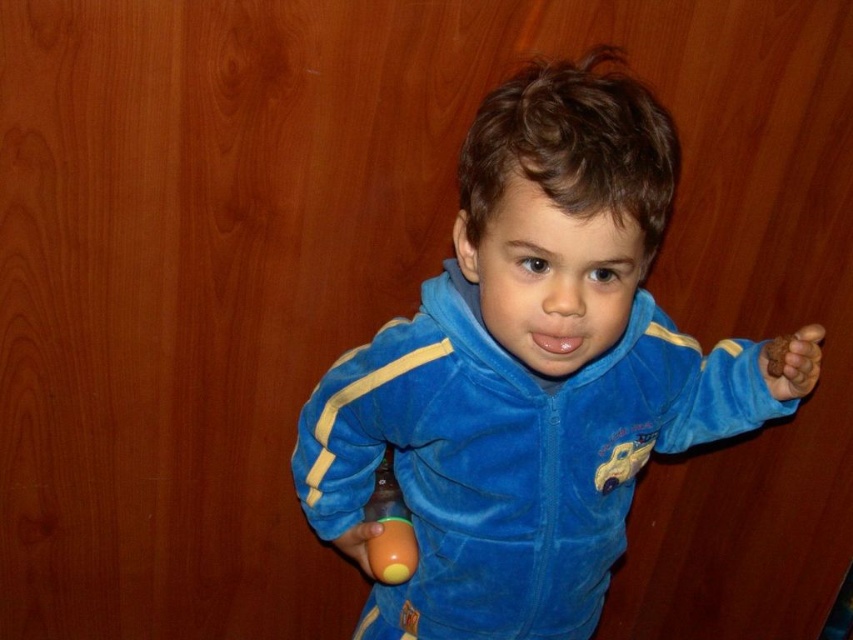
You are a photographer trying to capture the orange rubber ball at lower center in the image. The camera you are using has a focal point grid divided into 1000 equal squares horizontally and vertically. Where should you set the focal point coordinates to ensure the ball is centered in your shot?

The orange rubber ball at lower center is positioned at point coordinates of (389, 528). To center it, set the focal point to those coordinates, which correspond to 825 on the horizontal axis and 457 on the vertical axis out of 1000 divisions.

You are a parent trying to toss a ball to your child who is standing in front of you. You see the orange rubber ball at lower center. If you want to throw the ball to your child, will you have to throw it towards or away from yourself?

The orange rubber ball at lower center and viewer are 36.31 inches apart from each other. Since the ball is already between you and the child, you would need to throw it away from yourself to reach the child.

You are a fashion designer observing the child in the image. You need to determine the spatial relationship between the velvet blue tracksuit at center and the brown matte hand at right. Which object is positioned lower in the image?

The velvet blue tracksuit at center is positioned lower than the brown matte hand at right.